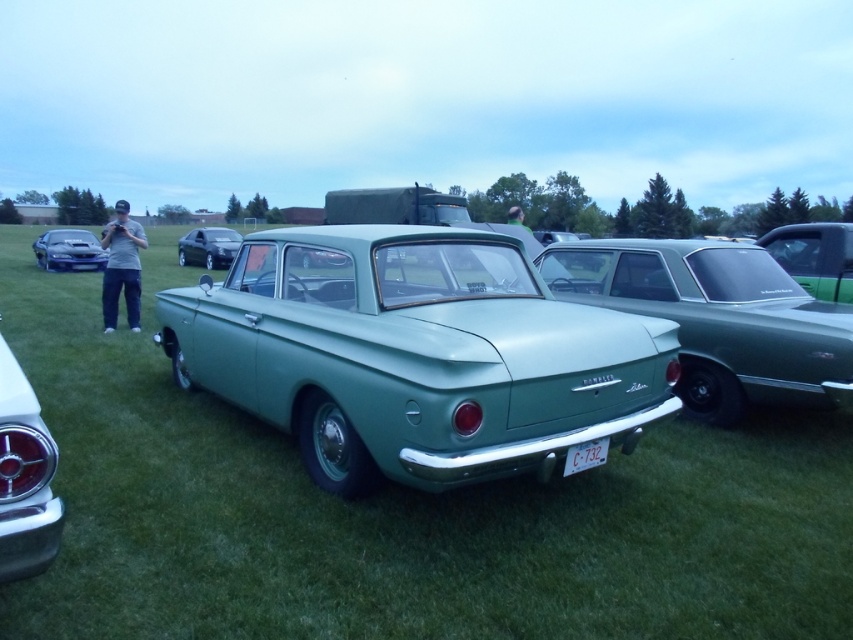
Can you confirm if green matte car at center is positioned below satin black car at center?

Indeed, green matte car at center is positioned under satin black car at center.

Does green matte car at center lie behind satin black car at center?

No.

Describe the element at coordinates (399, 513) in the screenshot. I see `green matte car at center` at that location.

Find the location of `green matte car at center`. green matte car at center is located at coordinates (399, 513).

Between satin black car at center and white plastic license plate at center, which one has less height?

Standing shorter between the two is white plastic license plate at center.

Is satin black car at center shorter than white plastic license plate at center?

No.

At what (x,y) coordinates should I click in order to perform the action: click on satin black car at center. Please return your answer as a coordinate pair (x, y). The height and width of the screenshot is (640, 853). Looking at the image, I should click on (207, 246).

In the scene shown: Who is higher up, matte green car at center or shiny blue car at left?

shiny blue car at left

Is matte green car at center further to camera compared to shiny blue car at left?

No, matte green car at center is in front of shiny blue car at left.

The height and width of the screenshot is (640, 853). What are the coordinates of `matte green car at center` in the screenshot? It's located at (415, 355).

The image size is (853, 640). In order to click on matte green car at center in this screenshot , I will do `click(415, 355)`.